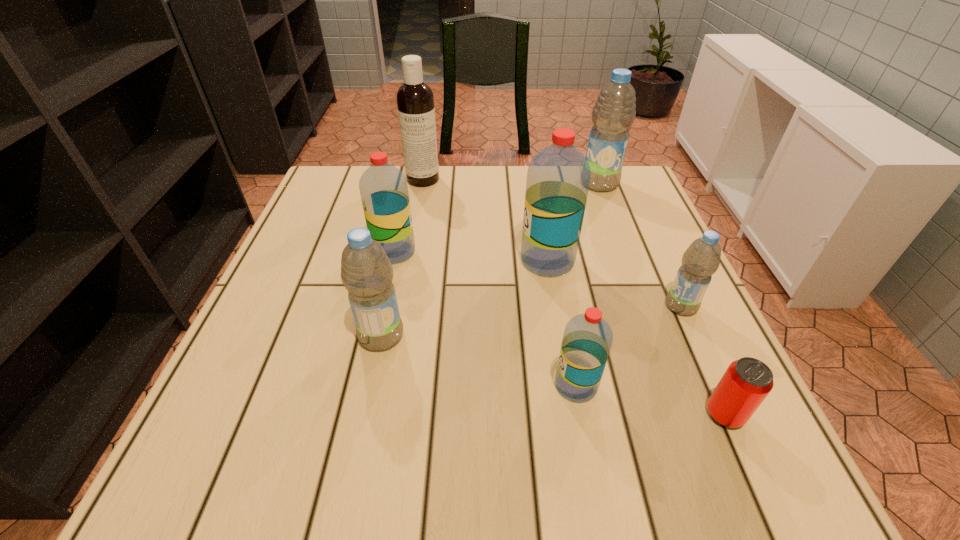
At what (x,y) coordinates should I click in order to perform the action: click on free region located on the front label of the nearest water bottle. Please return your answer as a coordinate pair (x, y). The height and width of the screenshot is (540, 960). Looking at the image, I should click on coord(454,386).

Locate an element on the screen. The image size is (960, 540). vacant area located 0.390m on the front label of the nearest water bottle is located at coordinates (324, 386).

This screenshot has height=540, width=960. In order to click on blank space located 0.090m on the front label of the nearest water bottle in this screenshot , I will do pos(501,386).

The height and width of the screenshot is (540, 960). What are the coordinates of `free space located 0.080m on the front of the can` in the screenshot? It's located at click(756, 484).

Find the location of `dishwasher detergent that is positioned at the far edge`. dishwasher detergent that is positioned at the far edge is located at coordinates (415, 101).

Where is `water bottle positioned at the far edge`? The width and height of the screenshot is (960, 540). water bottle positioned at the far edge is located at coordinates (614, 112).

Find the location of a particular element. The height and width of the screenshot is (540, 960). can that is at the right edge is located at coordinates (747, 381).

Where is `object positioned at the far right corner`? object positioned at the far right corner is located at coordinates (614, 112).

The image size is (960, 540). In the image, there is a desktop. In order to click on vacant space at the far edge in this screenshot , I will do [413, 204].

In the image, there is a desktop. At what (x,y) coordinates should I click in order to perform the action: click on vacant area at the near edge. Please return your answer as a coordinate pair (x, y). Looking at the image, I should click on (412, 442).